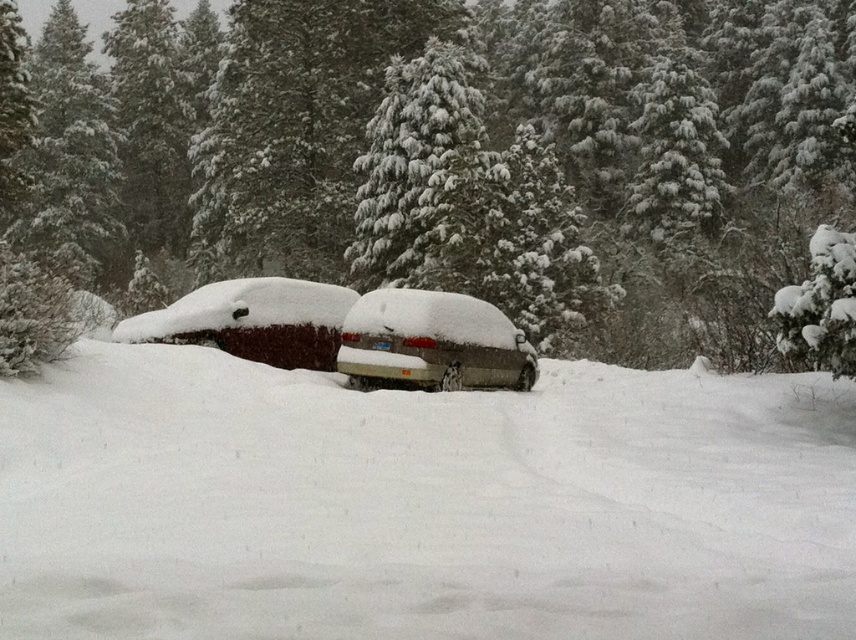
Question: Which point is closer to the camera taking this photo?

Choices:
 (A) 162,310
 (B) 432,44

Answer: (A)

Question: Which object is farther from the camera taking this photo?

Choices:
 (A) snow-covered sedan at center
 (B) snow-covered car at center
 (C) snow-covered evergreen tree at center
 (D) white fluffy snow at center

Answer: (B)

Question: Is white fluffy snow at center to the right of snow-covered sedan at center from the viewer's perspective?

Choices:
 (A) yes
 (B) no

Answer: (B)

Question: Does snow-covered evergreen tree at center have a lesser width compared to white fluffy snow at center?

Choices:
 (A) yes
 (B) no

Answer: (B)

Question: Can you confirm if snow-covered evergreen tree at center is wider than snow-covered sedan at center?

Choices:
 (A) no
 (B) yes

Answer: (B)

Question: Among these objects, which one is nearest to the camera?

Choices:
 (A) snow-covered sedan at center
 (B) snow-covered car at center

Answer: (A)